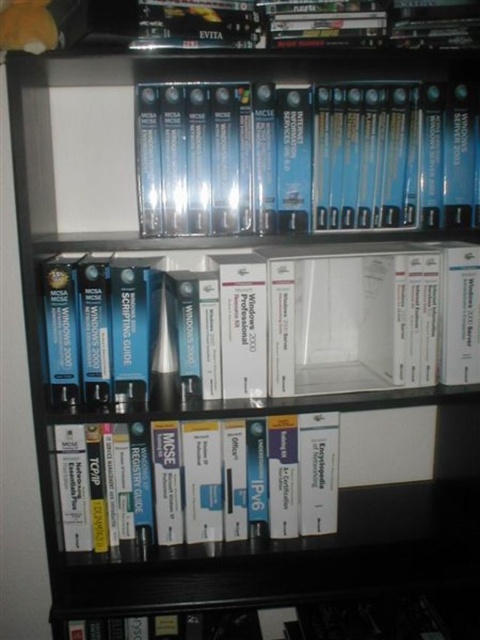
You are organizing a library and need to place the blue matte book at center and the hardcover book at lower center on a shelf. Based on their sizes, which book should you place first to ensure proper stacking?

The blue matte book at center is taller than the hardcover book at lower center, so you should place the taller blue matte book at center first to ensure stability when stacking.

You are organizing the bookshelf and need to retrieve the hardcover book at lower center. Is the blue matte book at center blocking your access to it?

The blue matte book at center is in front of the hardcover book at lower center, so it is blocking access to it.

You are a student who wants to pick up the hardcover book at lower center and the orange plush toy at upper left from the middle shelf. Which object will you need to reach further back to grab?

The orange plush toy at upper left is located further back on the middle shelf compared to the hardcover book at lower center, so you will need to reach further back to grab the orange plush toy at upper left.